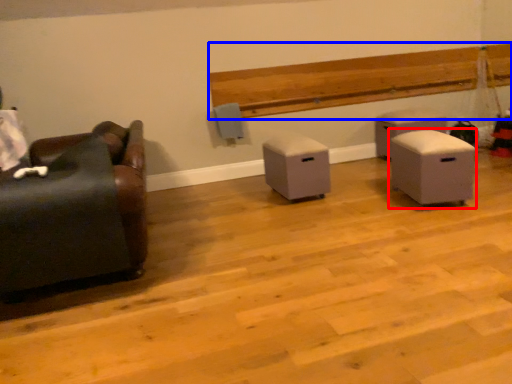
Question: Which object is further to the camera taking this photo, furniture (highlighted by a red box) or hardwood (highlighted by a blue box)?

Choices:
 (A) furniture
 (B) hardwood

Answer: (B)